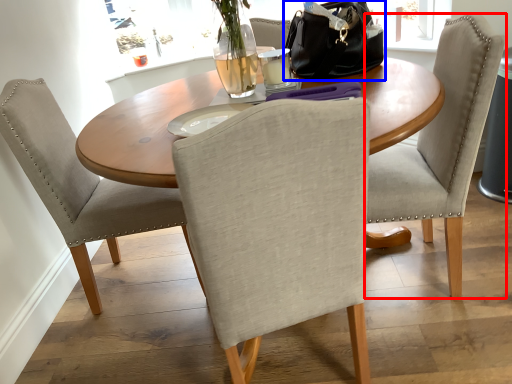
Question: Which point is further to the camera, chair (highlighted by a red box) or handbag (highlighted by a blue box)?

Choices:
 (A) chair
 (B) handbag

Answer: (B)